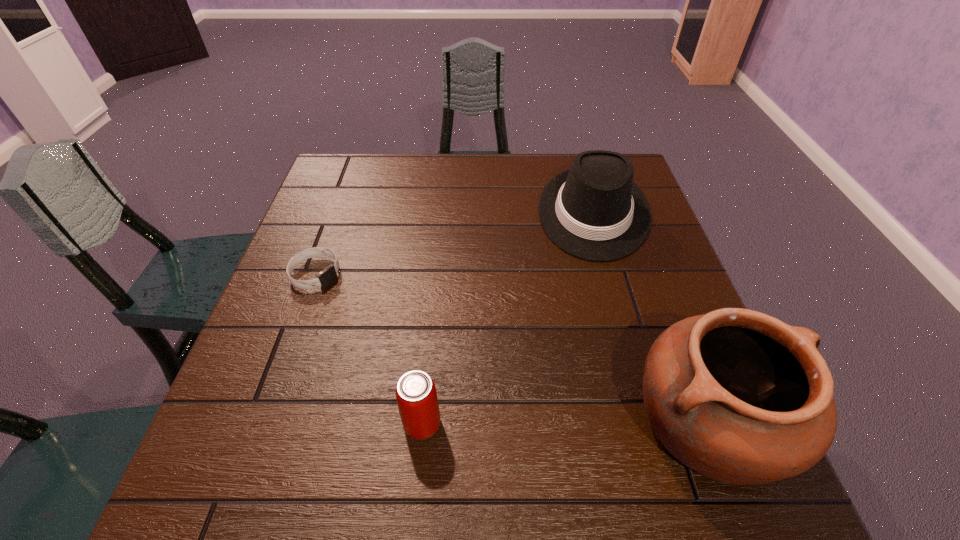
Find the location of `vacant space located on the front-facing side of the fedora`. vacant space located on the front-facing side of the fedora is located at coordinates (593, 341).

In order to click on vacant space located 0.140m on the front-facing side of the fedora in this screenshot , I will do `click(594, 305)`.

This screenshot has width=960, height=540. What are the coordinates of `blank space located 0.230m on the front-facing side of the fedora` in the screenshot? It's located at (593, 337).

At what (x,y) coordinates should I click in order to perform the action: click on object situated at the far edge. Please return your answer as a coordinate pair (x, y). The image size is (960, 540). Looking at the image, I should click on (594, 211).

The width and height of the screenshot is (960, 540). Find the location of `beer can that is positioned at the near edge`. beer can that is positioned at the near edge is located at coordinates (416, 395).

This screenshot has width=960, height=540. Identify the location of pottery located at the near edge. (738, 396).

At what (x,y) coordinates should I click in order to perform the action: click on object that is at the left edge. Please return your answer as a coordinate pair (x, y). Looking at the image, I should click on (329, 274).

Identify the location of pottery situated at the right edge. This screenshot has height=540, width=960. (738, 396).

I want to click on fedora at the right edge, so click(x=594, y=211).

The height and width of the screenshot is (540, 960). I want to click on object that is at the far right corner, so click(x=594, y=211).